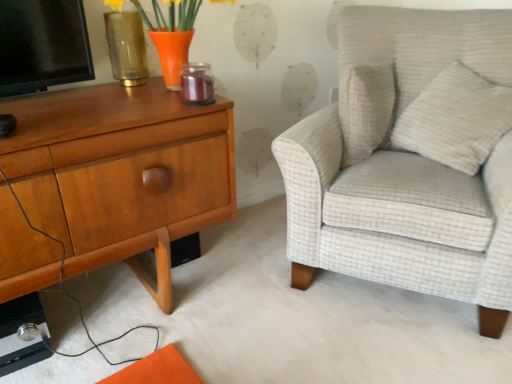
Identify the location of vacant space to the right of woodennightstand at left. (275, 323).